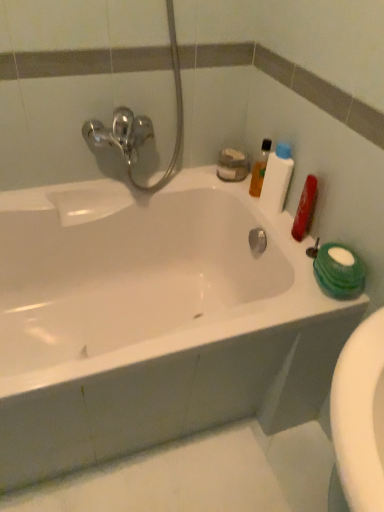
Question: Should I look upward or downward to see translucent plastic bottle at upper right?

Choices:
 (A) down
 (B) up

Answer: (B)

Question: Is translucent plastic bottle at upper right further to the viewer compared to translucent plastic bottle at upper right?

Choices:
 (A) no
 (B) yes

Answer: (A)

Question: Are translucent plastic bottle at upper right and translucent plastic bottle at upper right located far from each other?

Choices:
 (A) yes
 (B) no

Answer: (B)

Question: Can you confirm if translucent plastic bottle at upper right is positioned to the right of translucent plastic bottle at upper right?

Choices:
 (A) yes
 (B) no

Answer: (A)

Question: Is translucent plastic bottle at upper right bigger than translucent plastic bottle at upper right?

Choices:
 (A) yes
 (B) no

Answer: (A)

Question: Is translucent plastic bottle at upper right not within translucent plastic bottle at upper right?

Choices:
 (A) yes
 (B) no

Answer: (A)

Question: Can you confirm if translucent plastic bottle at upper right is wider than translucent plastic bottle at upper right?

Choices:
 (A) yes
 (B) no

Answer: (A)

Question: Considering the relative positions of white glossy bathtub at upper center and translucent plastic bottle at upper right in the image provided, is white glossy bathtub at upper center to the left of translucent plastic bottle at upper right from the viewer's perspective?

Choices:
 (A) yes
 (B) no

Answer: (A)

Question: Does white glossy bathtub at upper center have a larger size compared to translucent plastic bottle at upper right?

Choices:
 (A) yes
 (B) no

Answer: (A)

Question: Can you confirm if white glossy bathtub at upper center is positioned to the right of translucent plastic bottle at upper right?

Choices:
 (A) yes
 (B) no

Answer: (B)

Question: From the image's perspective, is white glossy bathtub at upper center below translucent plastic bottle at upper right?

Choices:
 (A) no
 (B) yes

Answer: (B)

Question: Is white glossy bathtub at upper center smaller than translucent plastic bottle at upper right?

Choices:
 (A) yes
 (B) no

Answer: (B)

Question: Does white glossy bathtub at upper center turn towards translucent plastic bottle at upper right?

Choices:
 (A) no
 (B) yes

Answer: (A)

Question: From a real-world perspective, is white glossy bathtub at upper center under translucent plastic bottle at upper right?

Choices:
 (A) no
 (B) yes

Answer: (B)